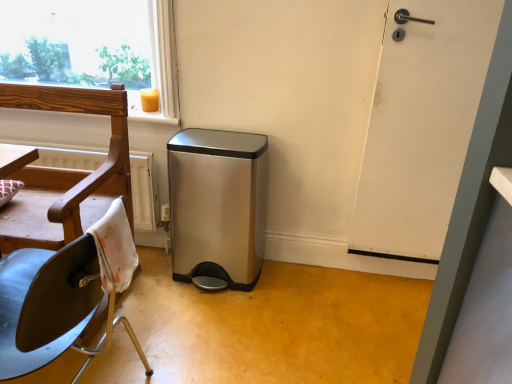
The width and height of the screenshot is (512, 384). I want to click on free spot in front of satin steel trash can at center, so click(x=209, y=313).